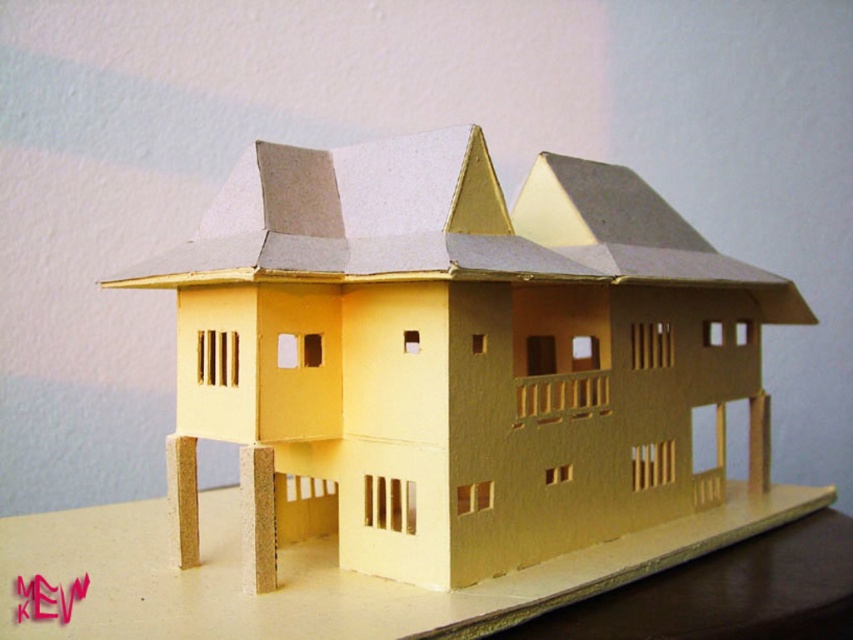
You are a delivery person who needs to place a matte cardboard box on the table. The box is exactly the same height as the matte cardboard table at lower center. Can you safely place the box on the table without it touching the matte cardboard house at center?

The matte cardboard house at center is taller than the matte cardboard table at lower center. Since the box is the same height as the table, placing it on the table would mean the box is shorter than the house, so it won

You are a delivery person who needs to place a heavy box on the surface where the matte cardboard table at lower center is located. However, there is a matte cardboard house at center on top of it. Can you place the box there without moving the house?

The matte cardboard house at center is positioned over the matte cardboard table at lower center, so placing the box there would require moving the house first to make space.

You are trying to place a new decorative item on the matte cardboard table at lower center. The item is as wide as the matte cardboard house at center. Will it fit on the table without hanging over the edges?

The matte cardboard house at center is narrower than the matte cardboard table at lower center, so the decorative item will fit on the table without overhanging since its width matches the house.